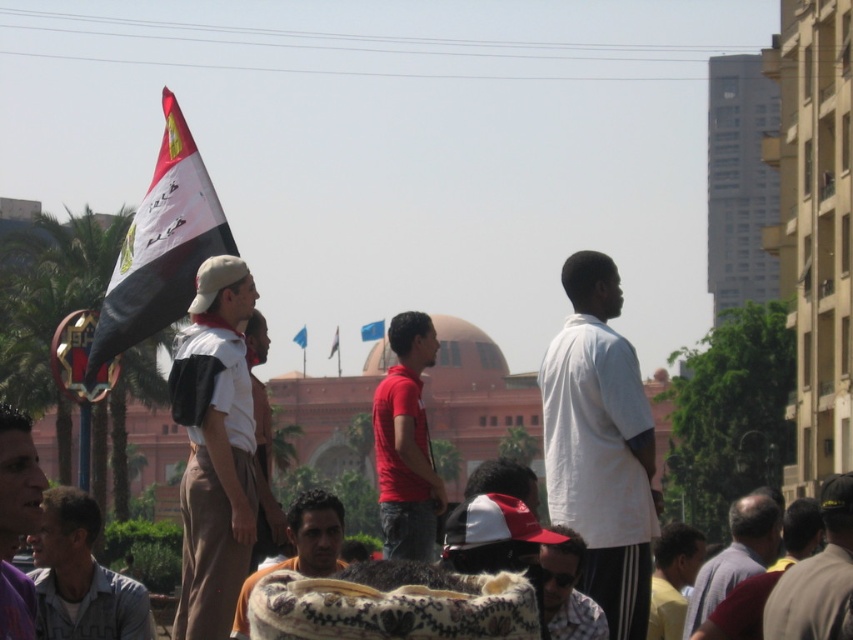
Question: Is red matte shirt at center thinner than light brown shirt at lower left?

Choices:
 (A) yes
 (B) no

Answer: (A)

Question: Estimate the real-world distances between objects in this image. Which object is farther from the light brown shirt at lower left?

Choices:
 (A) black fabric flag at upper left
 (B) blue fabric flag at center

Answer: (B)

Question: Does white matte shirt at center have a smaller size compared to blue fabric flag at center?

Choices:
 (A) yes
 (B) no

Answer: (B)

Question: Which object is closer to the camera taking this photo?

Choices:
 (A) black fabric flag at upper left
 (B) dark gray fabric shirt at center
 (C) yellow t-shirt at lower right

Answer: (B)

Question: Which point is closer to the camera?

Choices:
 (A) (810, 636)
 (B) (364, 330)
 (C) (294, 516)

Answer: (A)

Question: Is light brown shirt at lower left in front of blue fabric flag at center?

Choices:
 (A) no
 (B) yes

Answer: (B)